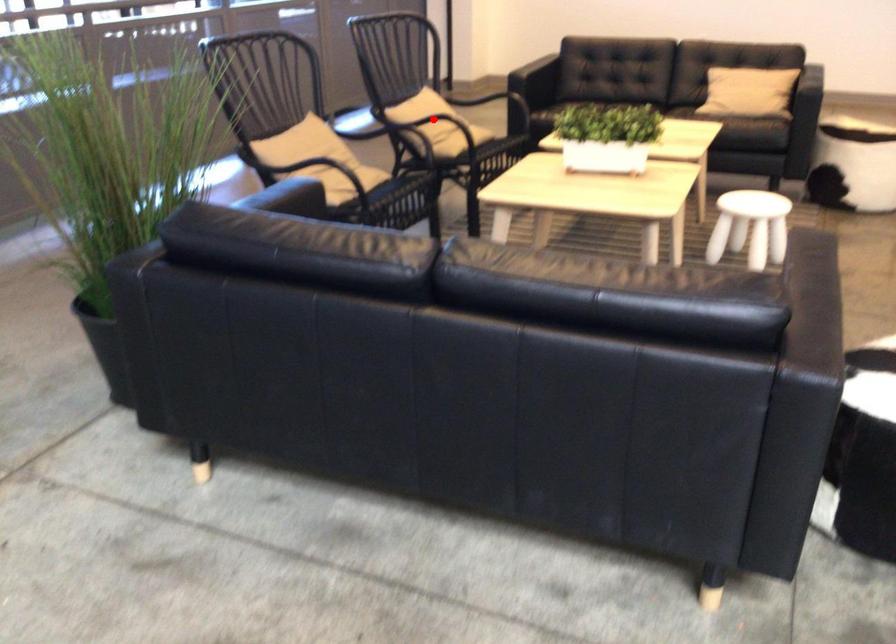
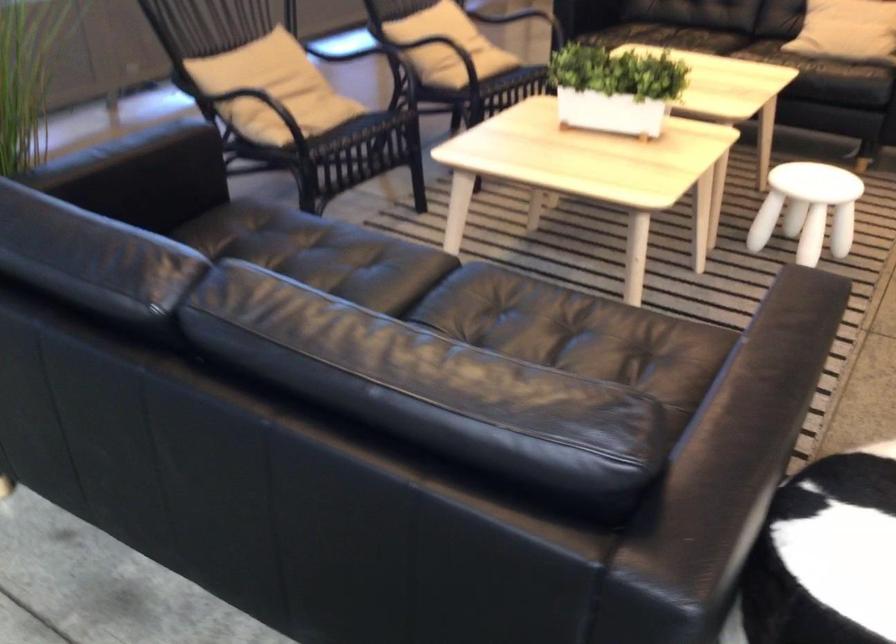
Question: I am providing you with two images of the same scene from different viewpoints. In image1, a red point is highlighted. Considering the same 3D point in image2, which of the following is correct?

Choices:
 (A) It is closer
 (B) It is farther

Answer: (A)